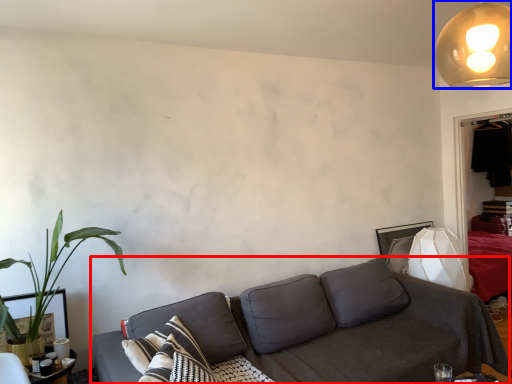
Question: Among these objects, which one is farthest to the camera, studio couch (highlighted by a red box) or lamp (highlighted by a blue box)?

Choices:
 (A) studio couch
 (B) lamp

Answer: (B)